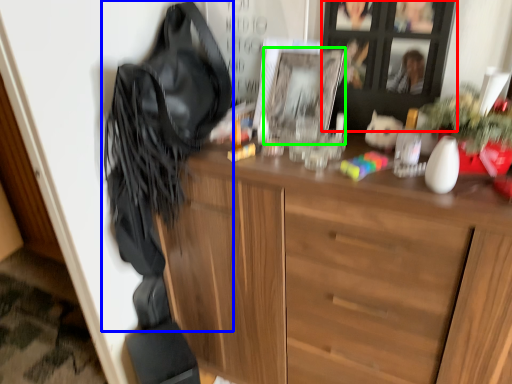
Question: Which is farther away from cabinetry (highlighted by a red box)? shoulder bag (highlighted by a blue box) or picture frame (highlighted by a green box)?

Choices:
 (A) shoulder bag
 (B) picture frame

Answer: (A)